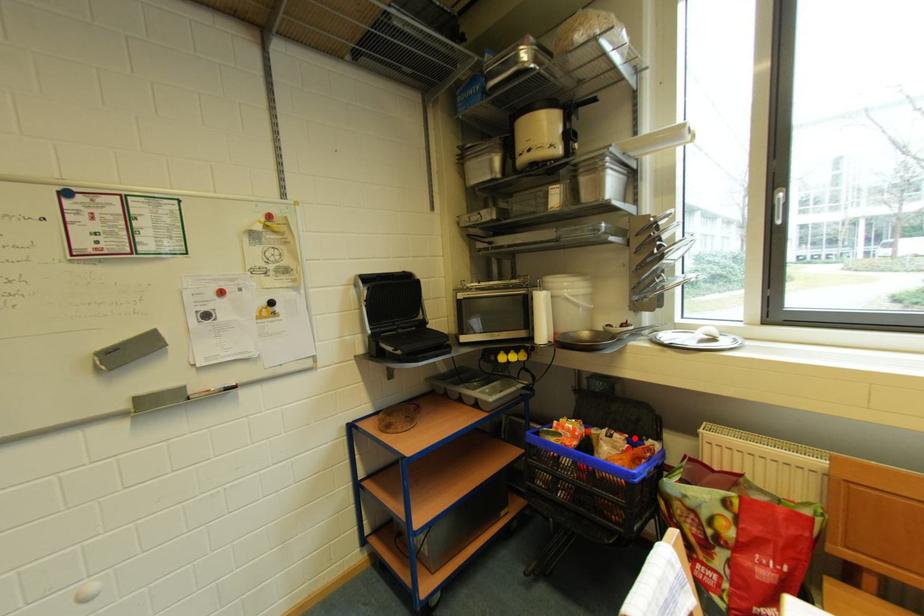
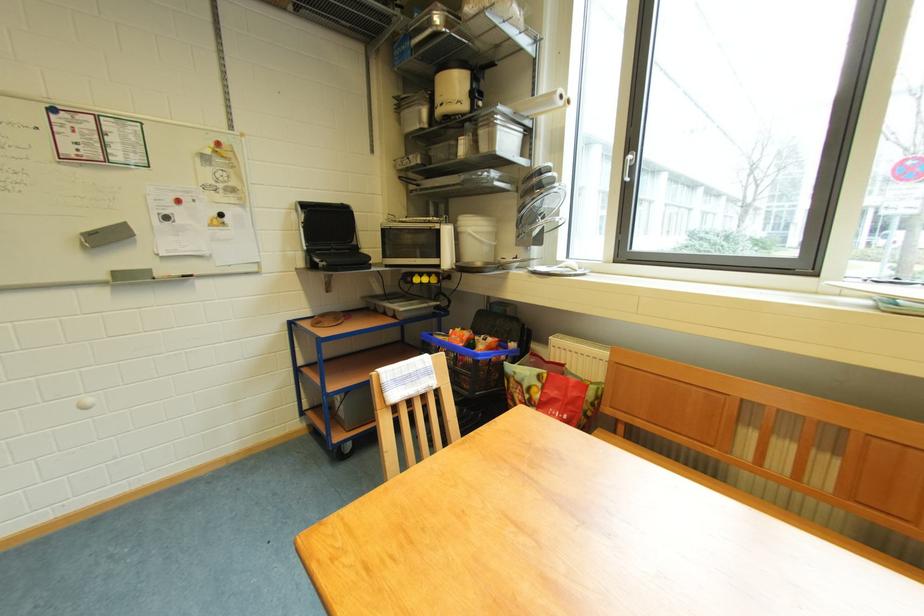
In the second image, find the point that corresponds to the highlighted location in the first image.

(504, 342)